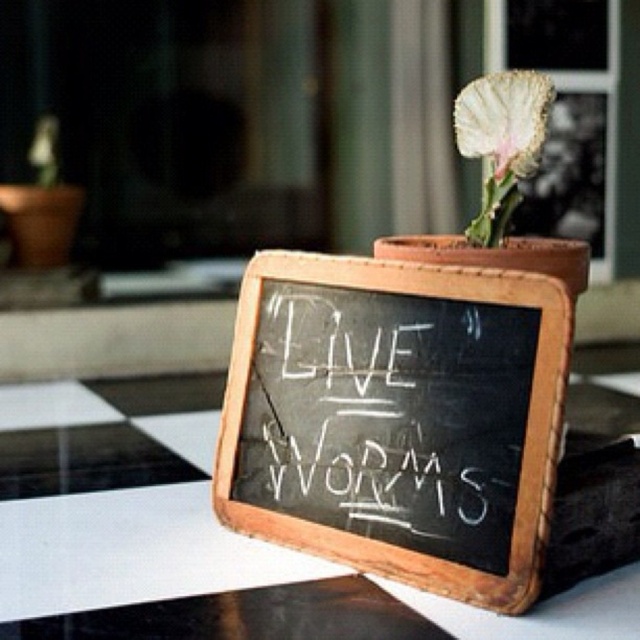
You are standing in front of a rustic wooden framed chalkboard on a glass table. You see a point marked at coordinates (376, 413). According to the scene description, where is this point located?

The point is located at the white chalk writing at center.

You are standing in front of the chalkboard and want to place a sticker on the point that is closer to you. Which point should you choose between point (260, 305) and point (456, 118)?

Point (260, 305) is in front of point (456, 118), so you should choose point (260, 305) as it is closer to you.

You are standing in front of the scene described. There is a point marked at coordinates (202, 536). What object is located at this point?

The point at coordinates (202, 536) indicates the black glass table at center.